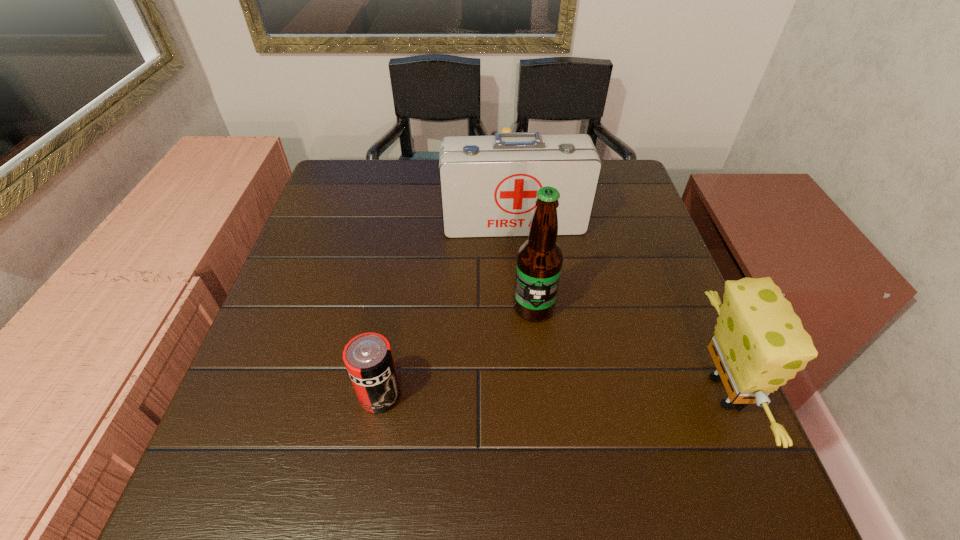
The height and width of the screenshot is (540, 960). I want to click on sponge situated at the near edge, so click(759, 343).

Where is `object located in the right edge section of the desktop`? object located in the right edge section of the desktop is located at coordinates (759, 343).

Find the location of a particular element. This screenshot has width=960, height=540. object located at the near right corner is located at coordinates (759, 343).

Identify the location of vacant region at the far edge. (422, 192).

Locate an element on the screen. blank space at the near edge of the desktop is located at coordinates (x=540, y=429).

At what (x,y) coordinates should I click in order to perform the action: click on vacant space at the left edge. Please return your answer as a coordinate pair (x, y). This screenshot has height=540, width=960. Looking at the image, I should click on click(x=325, y=220).

This screenshot has height=540, width=960. In the image, there is a desktop. What are the coordinates of `free space at the right edge` in the screenshot? It's located at (622, 320).

The image size is (960, 540). In the image, there is a desktop. Identify the location of vacant space at the far left corner. (327, 193).

This screenshot has height=540, width=960. In the image, there is a desktop. Find the location of `vacant space at the near left corner`. vacant space at the near left corner is located at coordinates (258, 439).

Locate an element on the screen. The width and height of the screenshot is (960, 540). free spot between the rightmost object and the second farthest object is located at coordinates (618, 307).